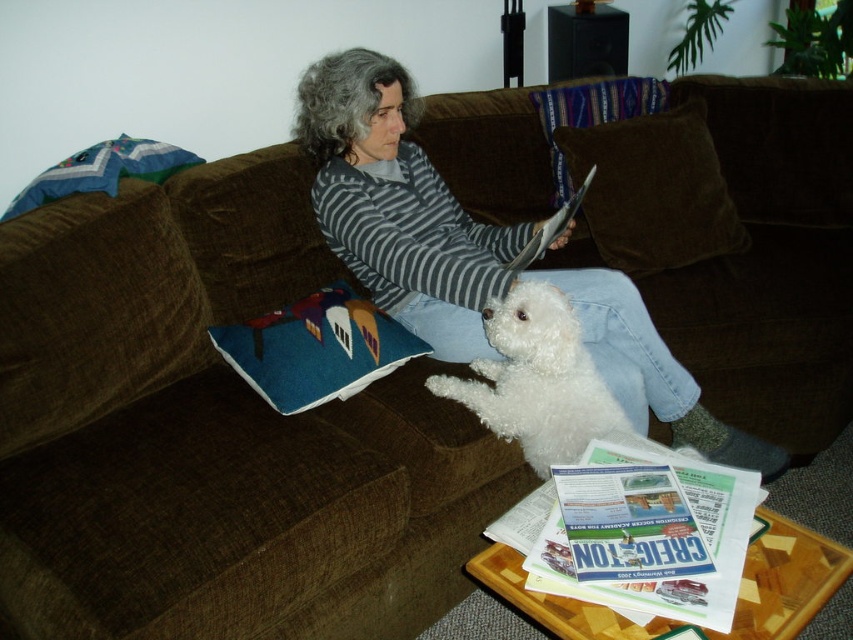
Question: Which of the following is the closest to the observer?

Choices:
 (A) (x=508, y=364)
 (B) (x=740, y=577)
 (C) (x=331, y=355)

Answer: (B)

Question: Which point appears farthest from the camera in this image?

Choices:
 (A) (553, 508)
 (B) (386, 333)
 (C) (466, 404)

Answer: (B)

Question: From the image, what is the correct spatial relationship of white glossy magazine at lower center in relation to blue felt pillow at lower center?

Choices:
 (A) above
 (B) below

Answer: (B)

Question: Which point is closer to the camera taking this photo?

Choices:
 (A) (732, 541)
 (B) (350, 314)
 (C) (624, 296)

Answer: (A)

Question: Does white fluffy dog at center appear over matte paper magazine at center?

Choices:
 (A) yes
 (B) no

Answer: (B)

Question: Where is white fluffy dog at center located in relation to blue felt pillow at lower center in the image?

Choices:
 (A) below
 (B) above

Answer: (A)